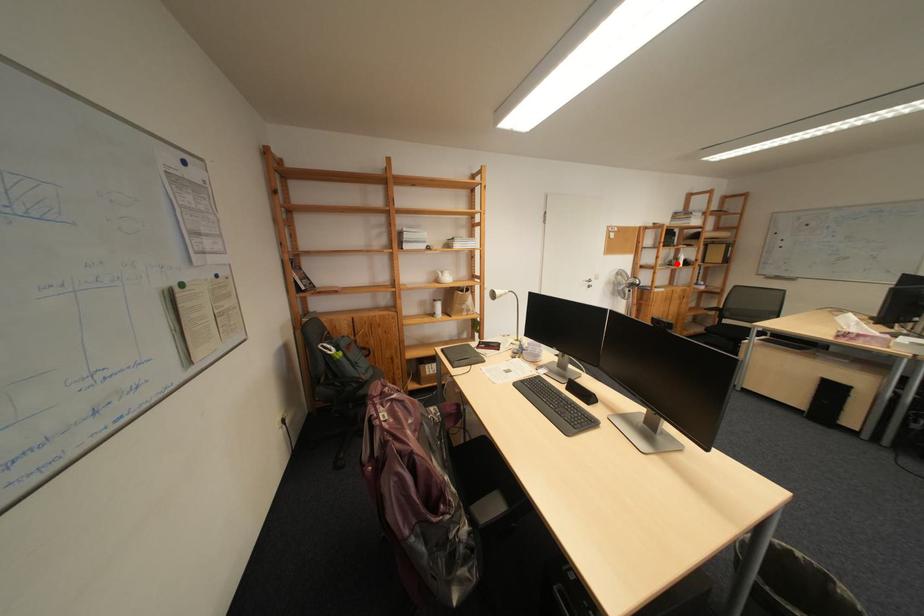
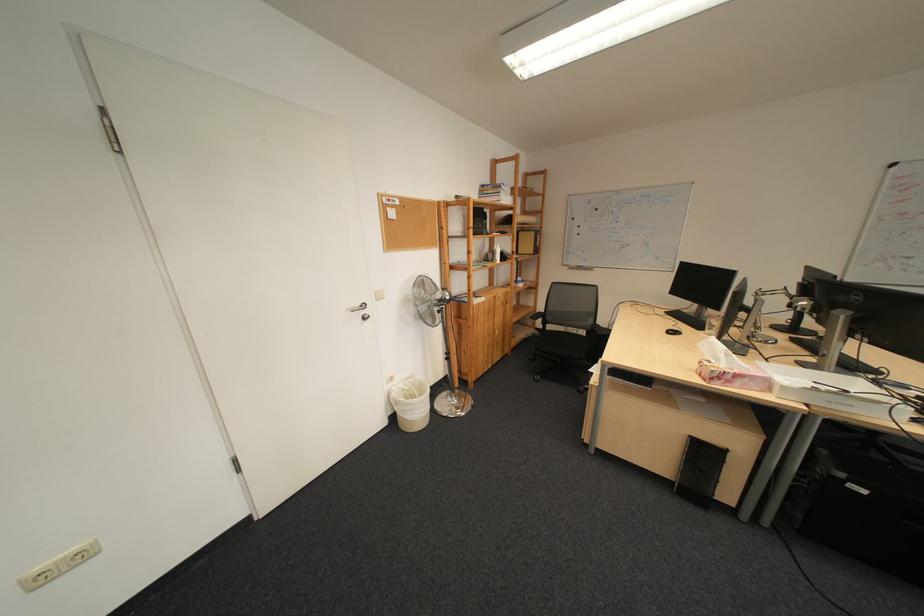
Locate, in the second image, the point that corresponds to the highlighted location in the first image.

(492, 257)